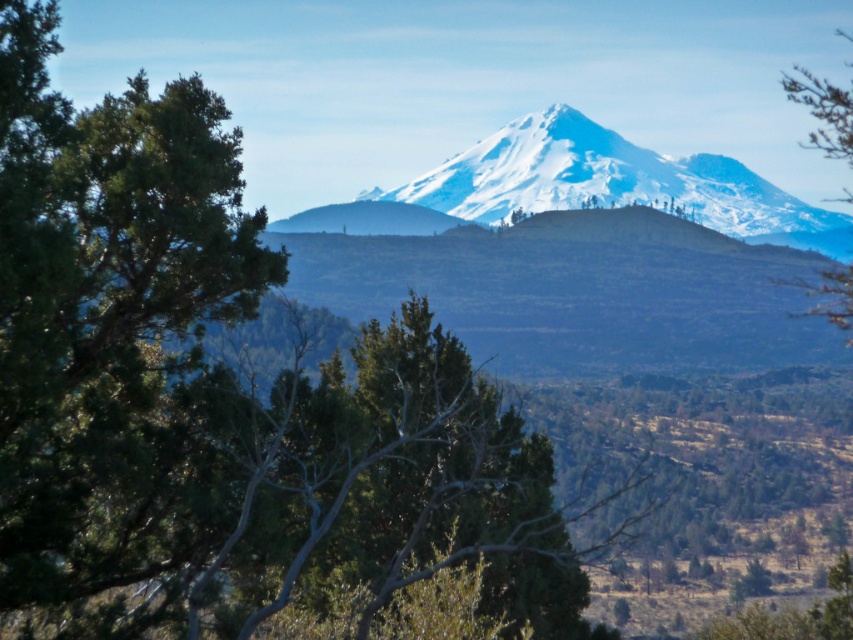
You are a hiker standing at the base of the snowy white mountain at center and want to reach the green matte tree at right. Given that your average walking pace is 1.5 meters per second, how long will it take you to reach the tree?

The distance between the snowy white mountain at center and the green matte tree at right is 29.49 meters. At a walking pace of 1.5 meters per second, it will take approximately 19.66 seconds to reach the tree.

You are standing at the base of the snowy white mountain at center. If you want to climb to the peak, which direction should you head?

The snowy white mountain at center is directly in front of you, so you should head towards the center to reach the peak.

You are standing at the base of the mountain and want to reach a specific point marked as point (712, 205). Given that your average walking speed is 3 miles per hour, how long would it take you to reach this point?

The distance between point (712, 205) and the viewer is 622.75 feet. Converting this to miles, it is approximately 0.118 miles. At a walking speed of 3 mph, the time taken would be roughly 0.118 miles divided by 3 mph, which equals approximately 0.039 hours. Converting hours to minutes by multiplying by 60, this is about 2.36 minutes. Therefore, it would take roughly 2.4 minutes to reach the point.